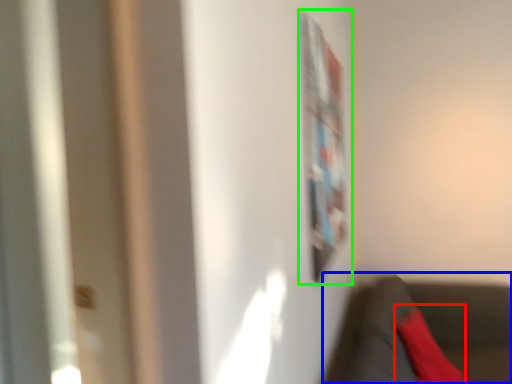
Question: Based on their relative distances, which object is nearer to pillow (highlighted by a red box)? Choose from chair (highlighted by a blue box) and bulletin board (highlighted by a green box).

Choices:
 (A) chair
 (B) bulletin board

Answer: (A)